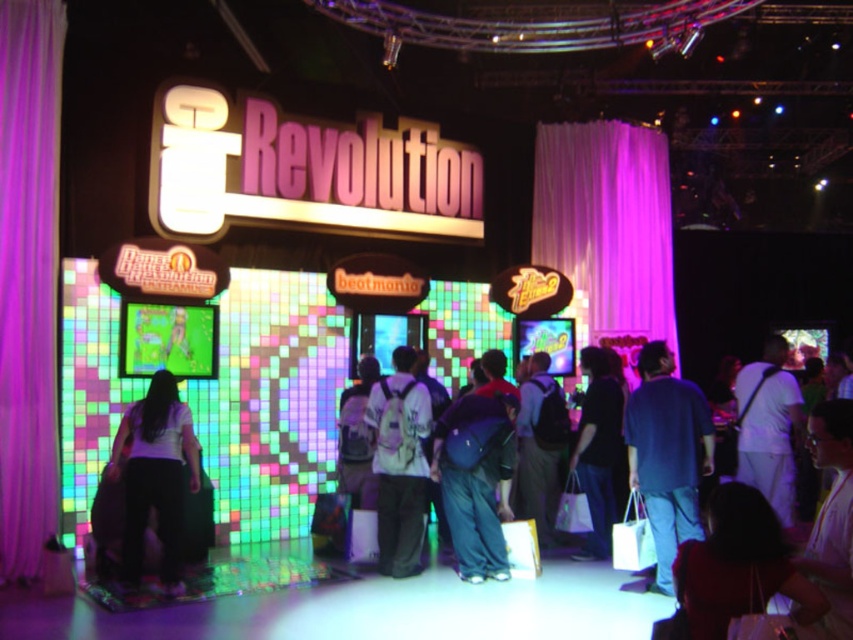
Does white fabric backpack at center have a greater width compared to dark blue backpack at center?

Yes.

Who is more forward, (416, 452) or (521, 413)?

Point (416, 452) is in front.

The height and width of the screenshot is (640, 853). Find the location of `white fabric backpack at center`. white fabric backpack at center is located at coordinates click(399, 464).

Is matte blue backpack at center to the right of dark blue backpack at center from the viewer's perspective?

No, matte blue backpack at center is not to the right of dark blue backpack at center.

Can you confirm if matte blue backpack at center is positioned to the left of dark blue backpack at center?

Indeed, matte blue backpack at center is positioned on the left side of dark blue backpack at center.

Is point (509, 416) closer to camera compared to point (521, 422)?

Yes, point (509, 416) is closer to viewer.

You are a GUI agent. You are given a task and a screenshot of the screen. Output one action in this format:
    pyautogui.click(x=<x>, y=<y>)
    Task: Click on the matte blue backpack at center
    
    Given the screenshot: What is the action you would take?
    pyautogui.click(x=476, y=480)

Which is in front, point (163, 467) or point (778, 337)?

Positioned in front is point (163, 467).

Is white matte shirt at center taller than white cotton shirt at right?

No.

You are a GUI agent. You are given a task and a screenshot of the screen. Output one action in this format:
    pyautogui.click(x=<x>, y=<y>)
    Task: Click on the white matte shirt at center
    
    Given the screenshot: What is the action you would take?
    pyautogui.click(x=155, y=476)